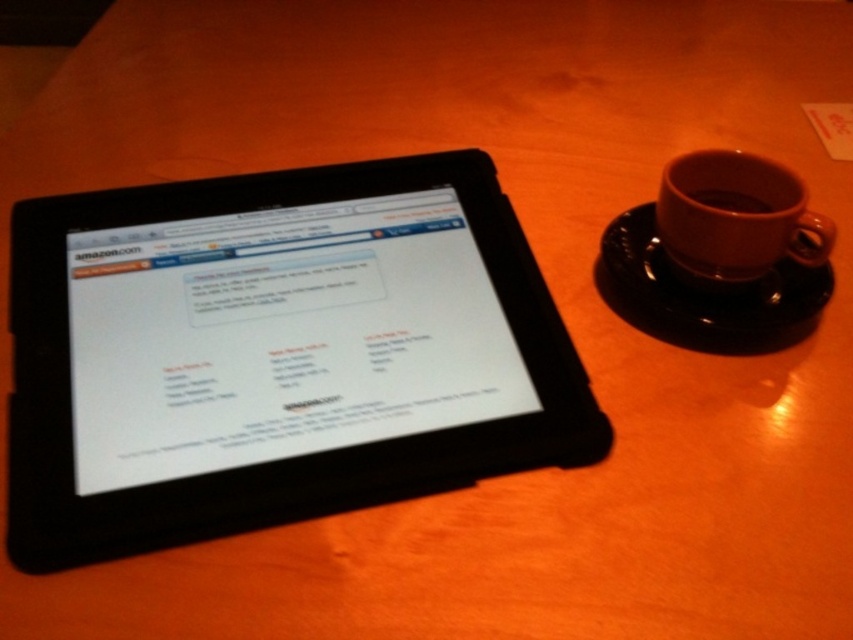
Question: Does black matte tablet at left appear under black ceramic saucer at right?

Choices:
 (A) yes
 (B) no

Answer: (A)

Question: Which object is positioned farthest from the black ceramic saucer at right?

Choices:
 (A) brown ceramic mug at upper right
 (B) black matte tablet at left
 (C) brown matte cup at right

Answer: (B)

Question: Which point is closer to the camera taking this photo?

Choices:
 (A) (740, 202)
 (B) (144, 452)

Answer: (B)

Question: Which of the following is the farthest from the observer?

Choices:
 (A) black matte tablet at left
 (B) brown matte cup at right
 (C) black ceramic saucer at right

Answer: (B)

Question: Is black matte tablet at left smaller than brown matte cup at right?

Choices:
 (A) no
 (B) yes

Answer: (A)

Question: Is the position of black ceramic saucer at right more distant than that of brown ceramic mug at upper right?

Choices:
 (A) yes
 (B) no

Answer: (A)